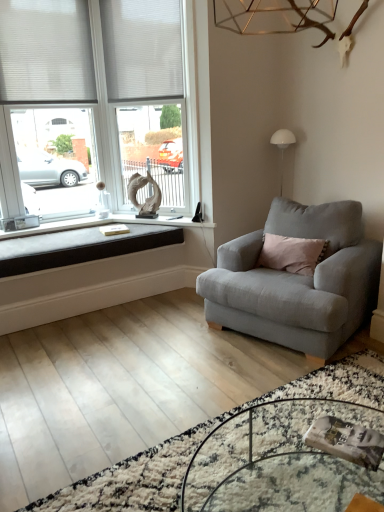
Find the location of `blank space to the left of light gray fabric armchair at right`. blank space to the left of light gray fabric armchair at right is located at coordinates pyautogui.click(x=159, y=342).